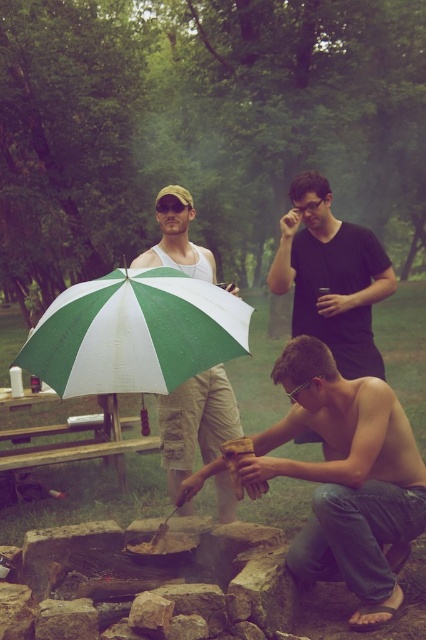
Question: Which point is closer to the camera taking this photo?

Choices:
 (A) (164, 385)
 (B) (302, 365)
 (C) (227, 481)
 (D) (311, 214)

Answer: (A)

Question: Can you confirm if wooden log at center is positioned below black matte shirt at upper center?

Choices:
 (A) no
 (B) yes

Answer: (B)

Question: Which object is the closest to the green and white umbrella at center?

Choices:
 (A) green and white fabric umbrella at center
 (B) wooden log at center
 (C) black matte shirt at upper center

Answer: (A)

Question: Does black matte shirt at upper center appear under green and white umbrella at center?

Choices:
 (A) yes
 (B) no

Answer: (B)

Question: From the image, what is the correct spatial relationship of green and white fabric umbrella at center in relation to black matte shirt at upper center?

Choices:
 (A) left
 (B) right

Answer: (A)

Question: Considering the real-world distances, which object is closest to the green and white umbrella at center?

Choices:
 (A) green and white fabric umbrella at center
 (B) wooden log at center

Answer: (A)